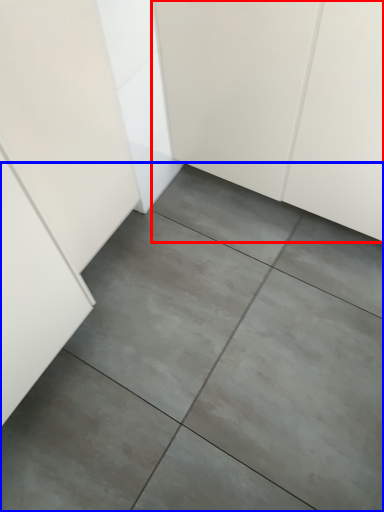
Question: Which object is closer to the camera taking this photo, cabinetry (highlighted by a red box) or concrete (highlighted by a blue box)?

Choices:
 (A) cabinetry
 (B) concrete

Answer: (A)